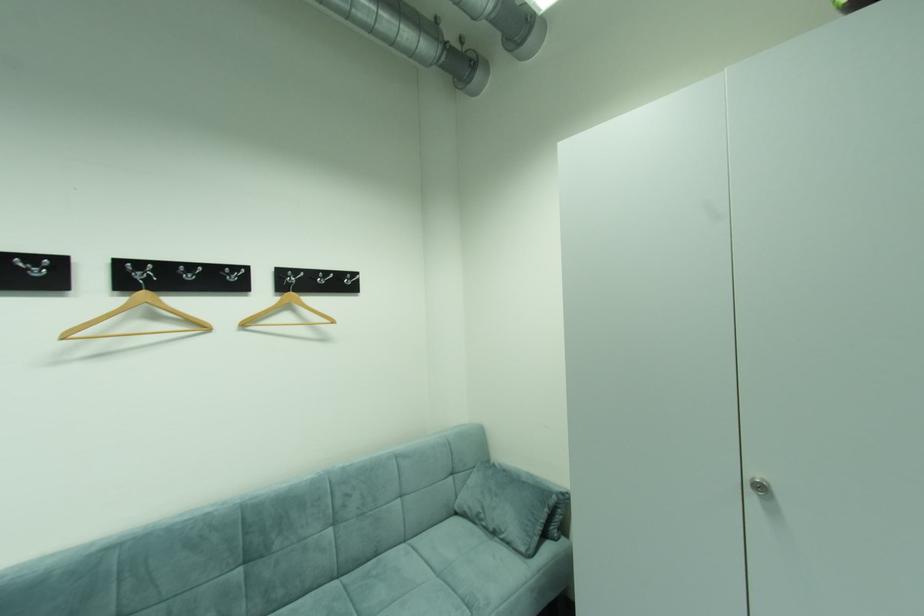
At what (x,y) coordinates should I click in order to perform the action: click on sofa sitting surface. Please return your answer as a coordinate pair (x, y). Looking at the image, I should click on (383, 590).